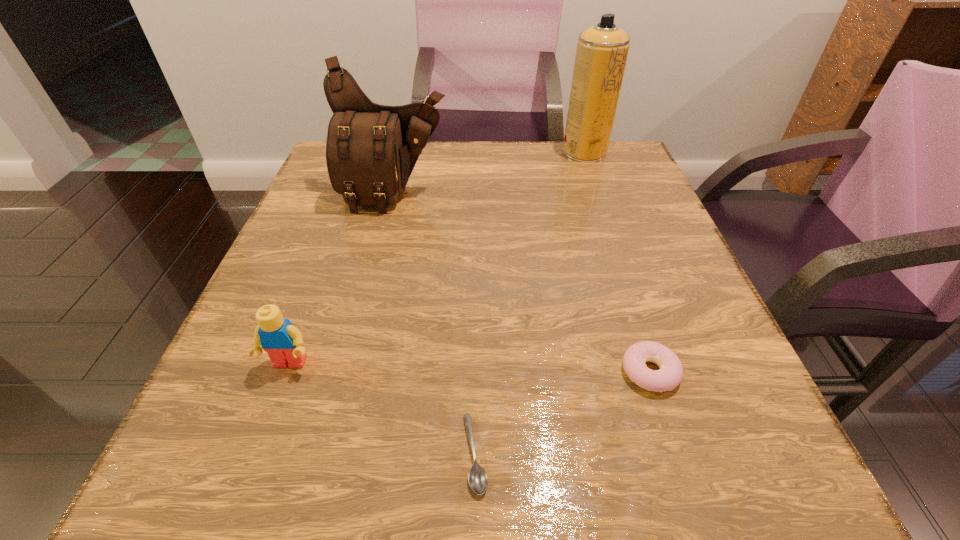
Where is `the farthest object`? the farthest object is located at coordinates [x=602, y=50].

Where is `shoulder bag`? The height and width of the screenshot is (540, 960). shoulder bag is located at coordinates (371, 150).

Identify the location of Lego. (278, 337).

I want to click on the second shortest object, so click(669, 376).

This screenshot has height=540, width=960. Identify the location of the third object from left to right. (478, 480).

Identify the location of soupspoon. (478, 480).

The height and width of the screenshot is (540, 960). I want to click on blank space located on the front of the aerosol can, so click(x=615, y=240).

Identify the location of vacant region located 0.330m on the front-facing side of the second farthest object. The width and height of the screenshot is (960, 540). (359, 339).

The width and height of the screenshot is (960, 540). What are the coordinates of `vacant space situated 0.110m on the front-facing side of the Lego` in the screenshot? It's located at (258, 448).

Image resolution: width=960 pixels, height=540 pixels. I want to click on vacant area located 0.250m on the back of the doughnut, so click(x=609, y=245).